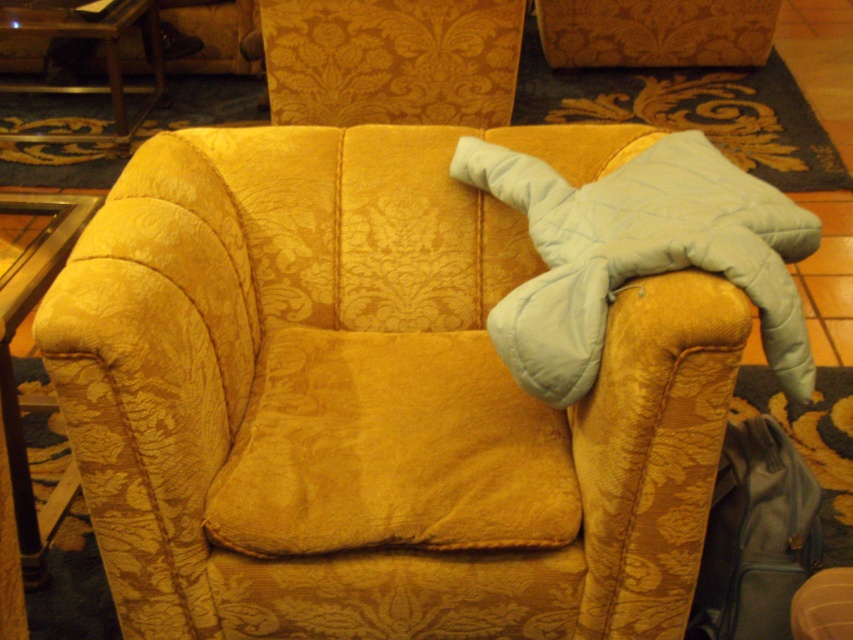
Question: Estimate the real-world distances between objects in this image. Which object is farther from the velvet gold couch at center?

Choices:
 (A) leather suitcase at lower right
 (B) velvet yellow pillow at center
 (C) light blue quilted blanket at upper right

Answer: (A)

Question: Does light blue quilted blanket at upper right have a larger size compared to leather suitcase at lower right?

Choices:
 (A) no
 (B) yes

Answer: (B)

Question: Which point is closer to the camera taking this photo?

Choices:
 (A) (480, 371)
 (B) (703, 140)

Answer: (B)

Question: Which point is closer to the camera taking this photo?

Choices:
 (A) (485, 586)
 (B) (556, 355)
 (C) (408, 515)
 (D) (729, 616)

Answer: (B)

Question: Where is velvet gold couch at center located in relation to light blue quilted blanket at upper right in the image?

Choices:
 (A) below
 (B) above

Answer: (A)

Question: Can you confirm if velvet yellow pillow at center is smaller than leather suitcase at lower right?

Choices:
 (A) yes
 (B) no

Answer: (B)